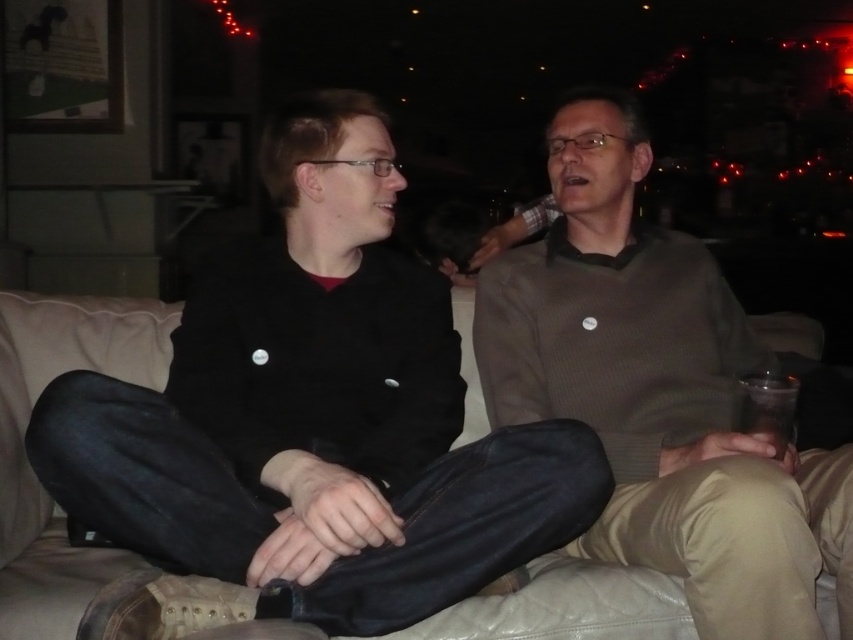
Which is more to the left, black matte jacket at center or transparent plastic cup at lower right?

black matte jacket at center is more to the left.

Measure the distance between black matte jacket at center and camera.

3.37 feet

Is point (201, 275) farther from viewer compared to point (776, 396)?

Yes, point (201, 275) is behind point (776, 396).

At what (x,y) coordinates should I click in order to perform the action: click on black matte jacket at center. Please return your answer as a coordinate pair (x, y). Looking at the image, I should click on (317, 413).

Does matte brown sweater at center come in front of beige leather couch at center?

That is True.

Measure the distance between point (569,298) and camera.

A distance of 1.59 meters exists between point (569,298) and camera.

You are a GUI agent. You are given a task and a screenshot of the screen. Output one action in this format:
    pyautogui.click(x=<x>, y=<y>)
    Task: Click on the matte brown sweater at center
    The width and height of the screenshot is (853, 640).
    Given the screenshot: What is the action you would take?
    click(659, 392)

Which of these two, matte brown sweater at center or transparent plastic cup at lower right, stands taller?

matte brown sweater at center

Who is more forward, (525,320) or (781,416)?

Point (781,416) is more forward.

Locate an element on the screen. The width and height of the screenshot is (853, 640). matte brown sweater at center is located at coordinates (659, 392).